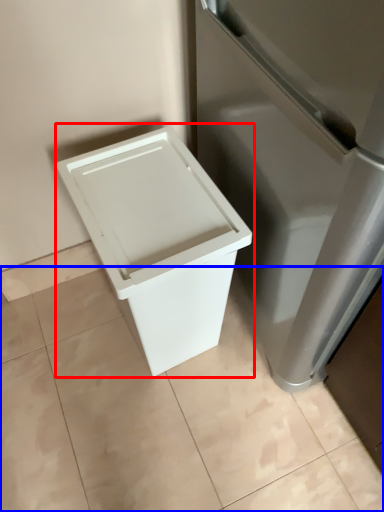
Question: Which point is closer to the camera, waste container (highlighted by a red box) or tile (highlighted by a blue box)?

Choices:
 (A) waste container
 (B) tile

Answer: (A)